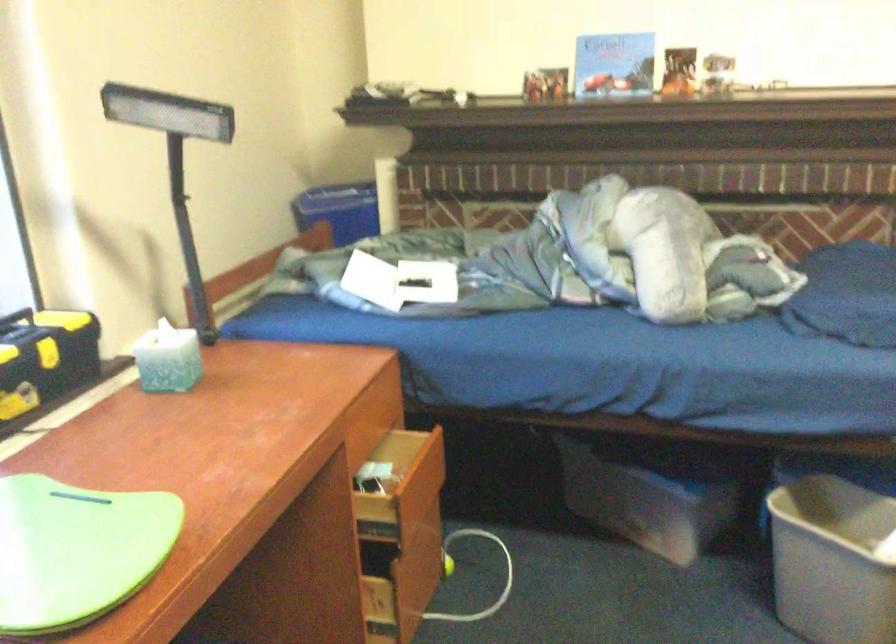
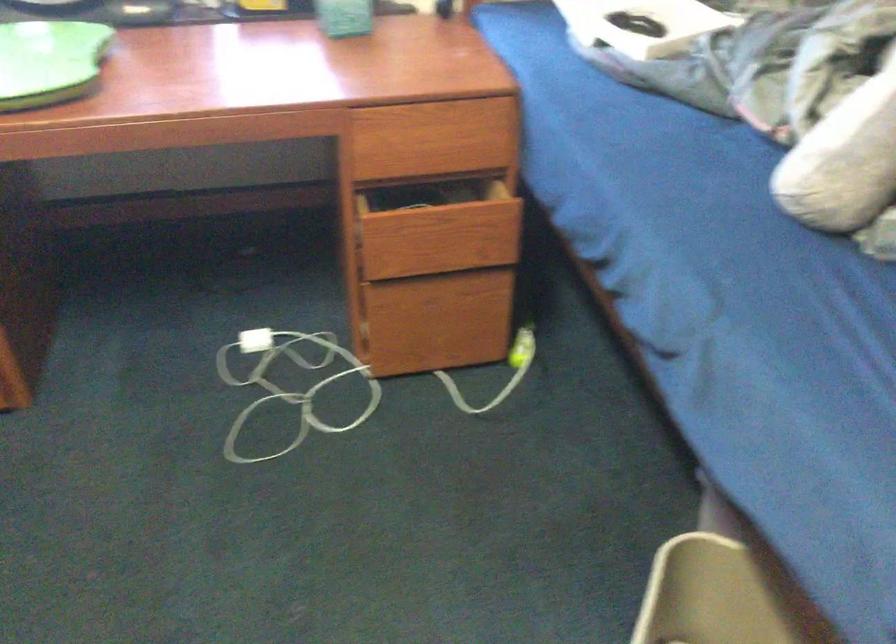
Find the pixel in the second image that matches the point at 364,421 in the first image.

(435, 136)